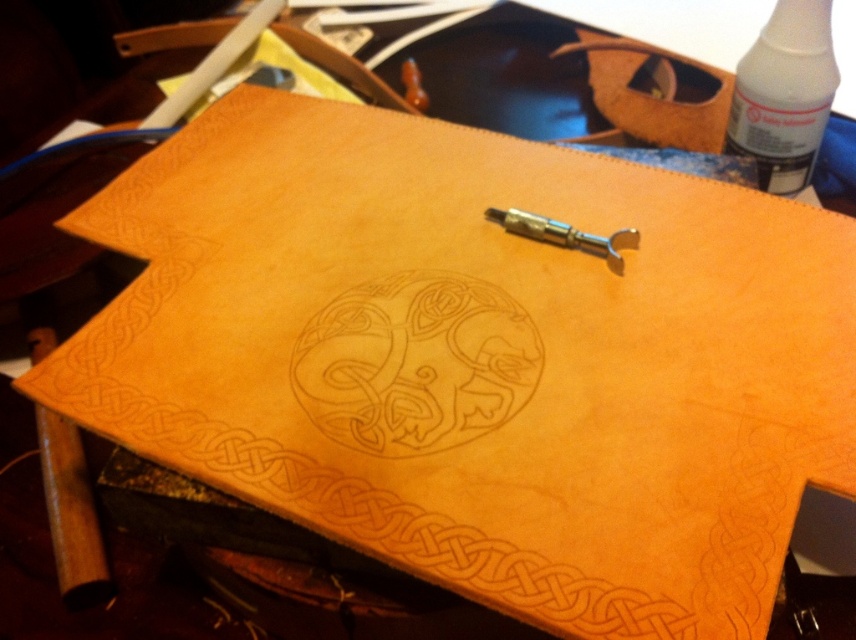
Question: Considering the real-world distances, which object is closest to the white glossy bottle at upper right?

Choices:
 (A) polished brass tool at center
 (B) light brown leather design at center

Answer: (A)

Question: Does light brown leather design at center appear over polished brass tool at center?

Choices:
 (A) no
 (B) yes

Answer: (A)

Question: Does white glossy bottle at upper right have a larger size compared to polished brass tool at center?

Choices:
 (A) no
 (B) yes

Answer: (B)

Question: Does light brown leather design at center appear on the right side of white glossy bottle at upper right?

Choices:
 (A) yes
 (B) no

Answer: (B)

Question: Which of the following is the farthest from the observer?

Choices:
 (A) (633, 237)
 (B) (337, 404)

Answer: (A)

Question: Which point is closer to the camera?

Choices:
 (A) white glossy bottle at upper right
 (B) light brown leather design at center

Answer: (B)